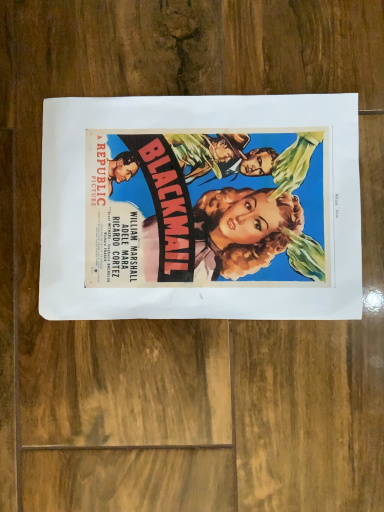
Where is `vacant space situated above matte paper poster at center (from a real-world perspective)`? The width and height of the screenshot is (384, 512). vacant space situated above matte paper poster at center (from a real-world perspective) is located at coordinates (198, 203).